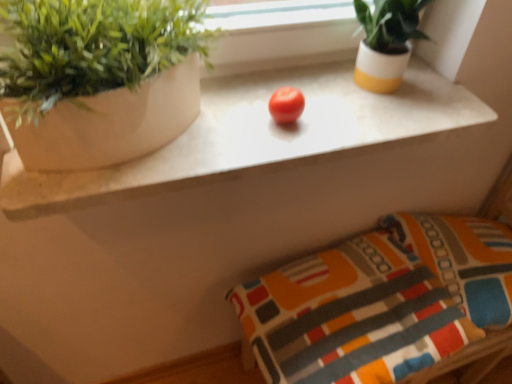
Where is `vacant space to the right of red matte tomato at center`? This screenshot has width=512, height=384. vacant space to the right of red matte tomato at center is located at coordinates (355, 116).